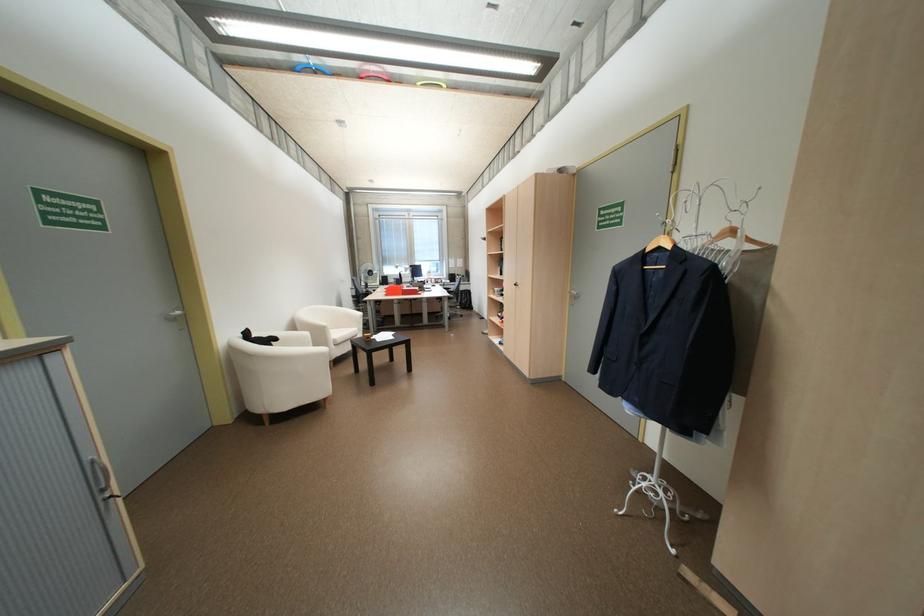
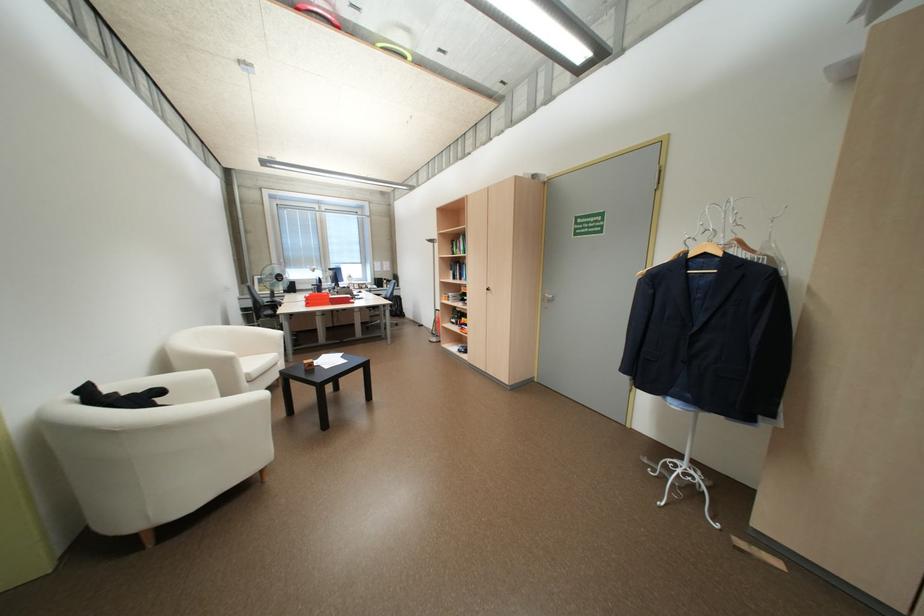
Locate, in the second image, the point that corresponds to point (580, 296) in the first image.

(553, 299)